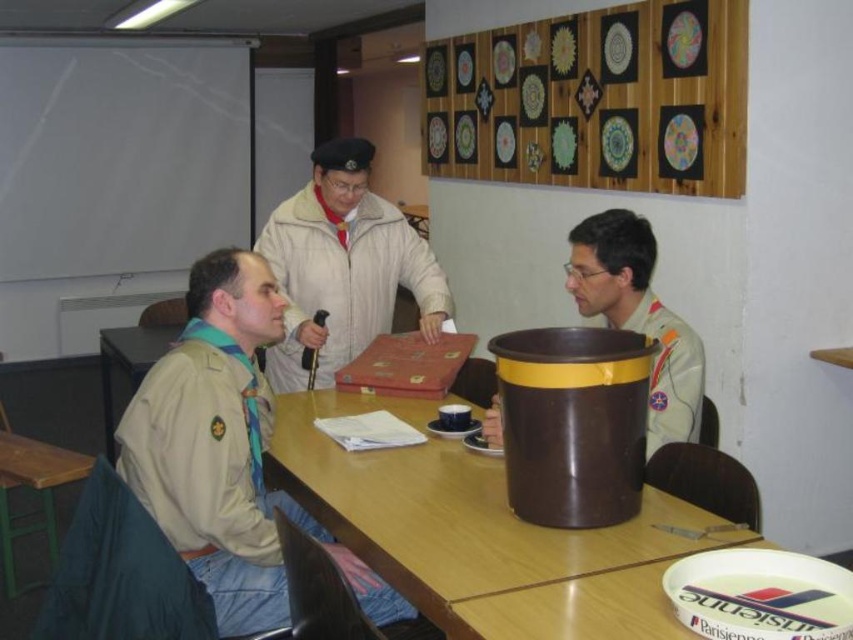
You are standing at point [132,342] and want to walk to the trash bin located at point [358,588]. Is the trash bin in front of you?

Yes, the trash bin located at point [358,588] is in front of you because the point [358,588] is in front of point [132,342].